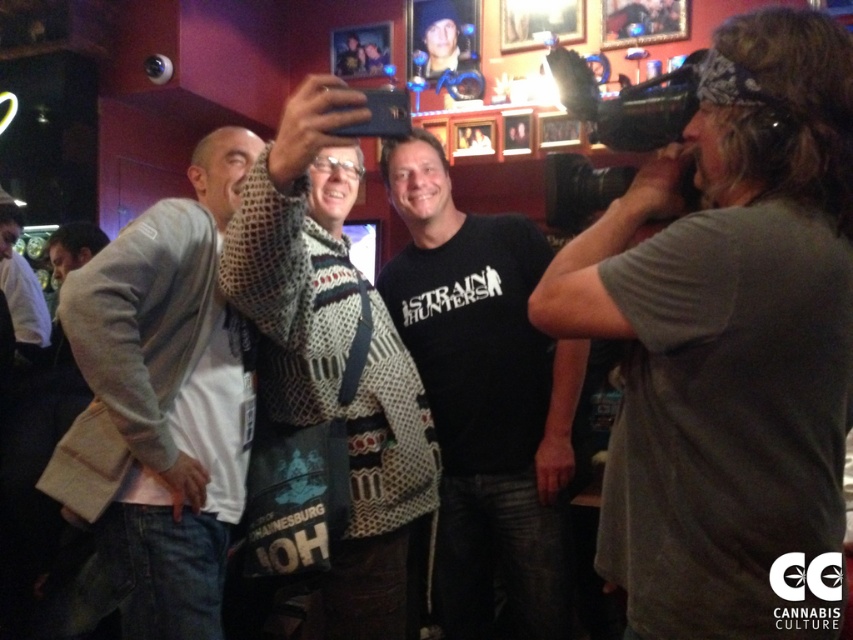
Question: Which point is farther from the camera taking this photo?

Choices:
 (A) (662, 180)
 (B) (294, 216)
 (C) (491, 336)
 (D) (189, 460)

Answer: (C)

Question: Can you confirm if gray cotton t-shirt at right is wider than black cotton t-shirt at center?

Choices:
 (A) yes
 (B) no

Answer: (B)

Question: Which of these objects is positioned farthest from the knitted sweater at center?

Choices:
 (A) black cotton t-shirt at center
 (B) gray cotton t-shirt at right
 (C) light gray sweater at left

Answer: (B)

Question: From the image, what is the correct spatial relationship of gray cotton t-shirt at right in relation to light gray sweater at left?

Choices:
 (A) right
 (B) left

Answer: (A)

Question: Which of these objects is positioned farthest from the gray cotton t-shirt at right?

Choices:
 (A) knitted sweater at center
 (B) light gray sweater at left
 (C) black cotton t-shirt at center

Answer: (B)

Question: Is black cotton t-shirt at center to the right of knitted sweater at center from the viewer's perspective?

Choices:
 (A) no
 (B) yes

Answer: (B)